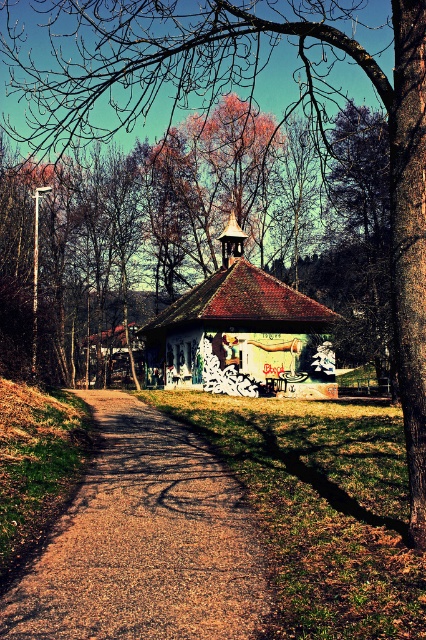
Question: Among these objects, which one is farthest from the camera?

Choices:
 (A) grungy painted hut at center
 (B) brown gravel path at center

Answer: (A)

Question: Is the position of brown gravel path at center less distant than that of grungy painted hut at center?

Choices:
 (A) no
 (B) yes

Answer: (B)

Question: Does brown gravel path at center appear over grungy painted hut at center?

Choices:
 (A) no
 (B) yes

Answer: (A)

Question: Which point is farther to the camera?

Choices:
 (A) (57, 568)
 (B) (199, 282)

Answer: (B)

Question: Does brown gravel path at center have a lesser width compared to grungy painted hut at center?

Choices:
 (A) no
 (B) yes

Answer: (B)